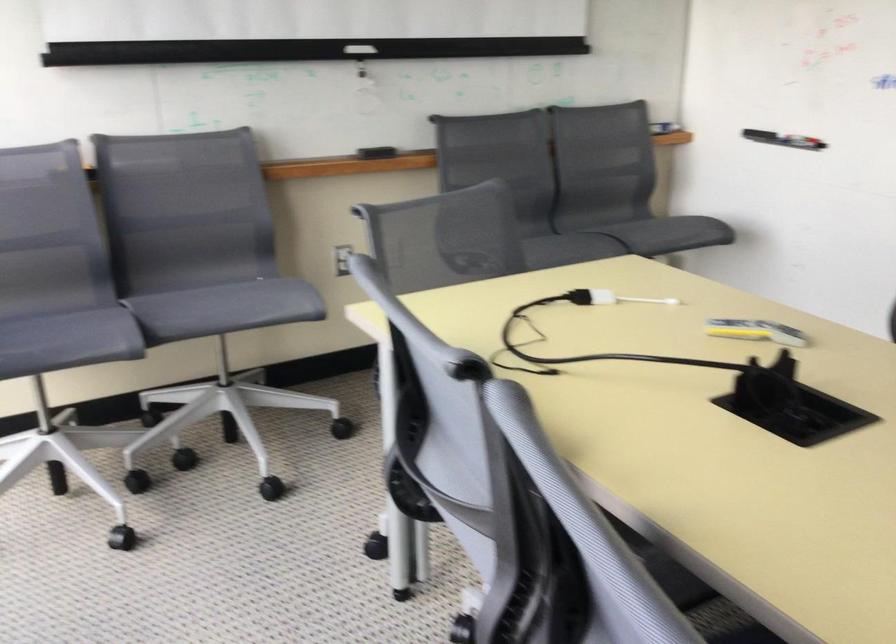
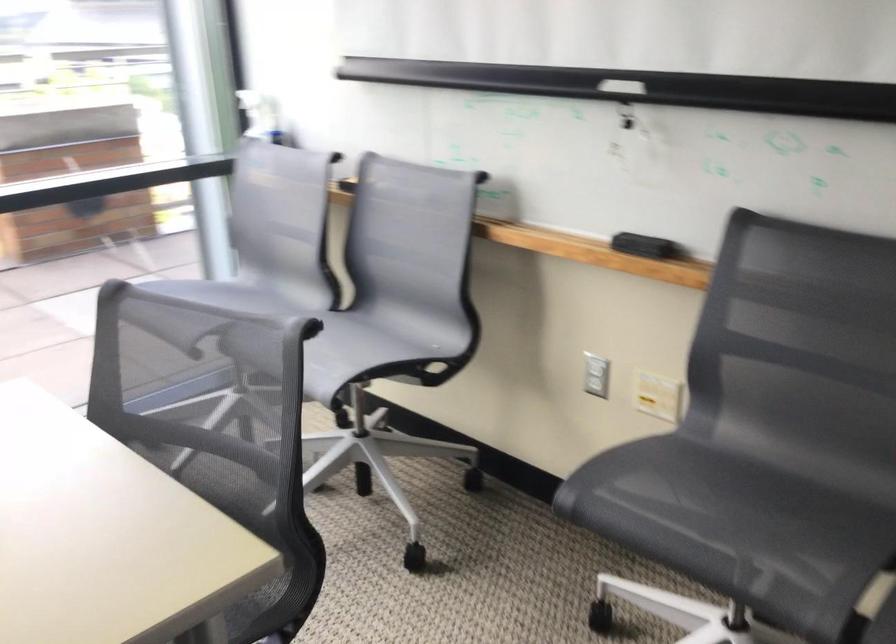
Locate, in the second image, the point that corresponds to [220,138] in the first image.

(457, 182)